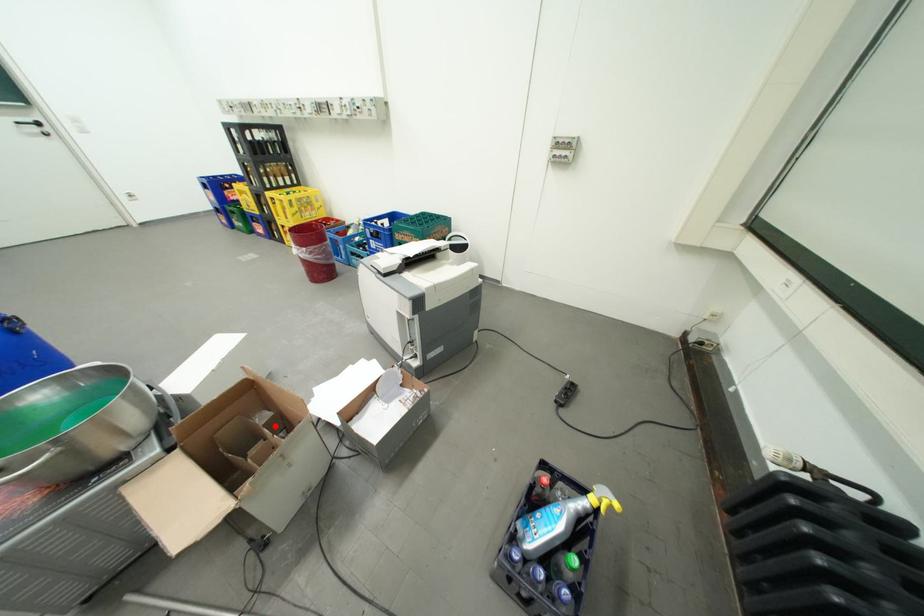
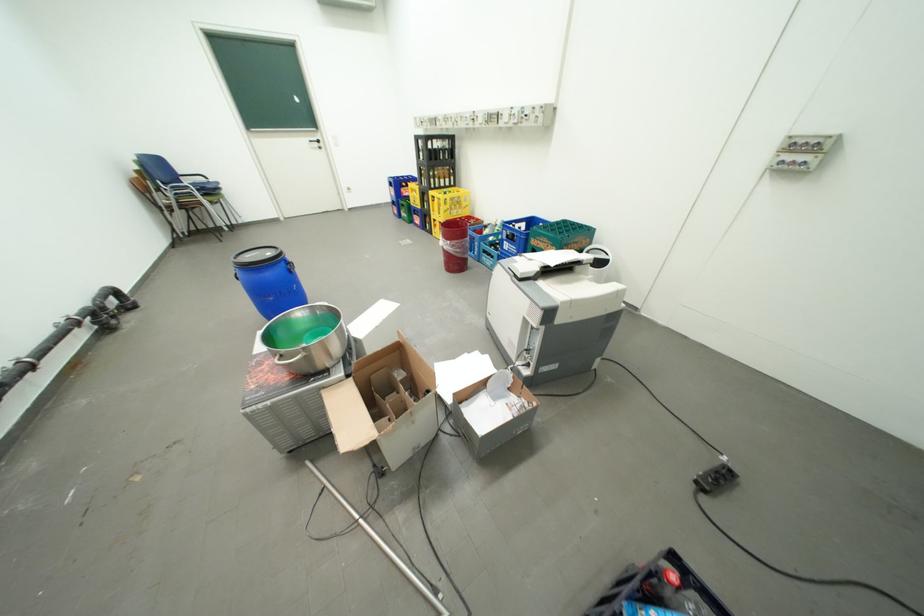
Question: I am providing you with two images of the same scene from different viewpoints. Image1 has a red point marked. In image2, the corresponding 3D location appears at what relative position? Reply with the corresponding letter.

Choices:
 (A) Closer
 (B) Farther

Answer: (B)